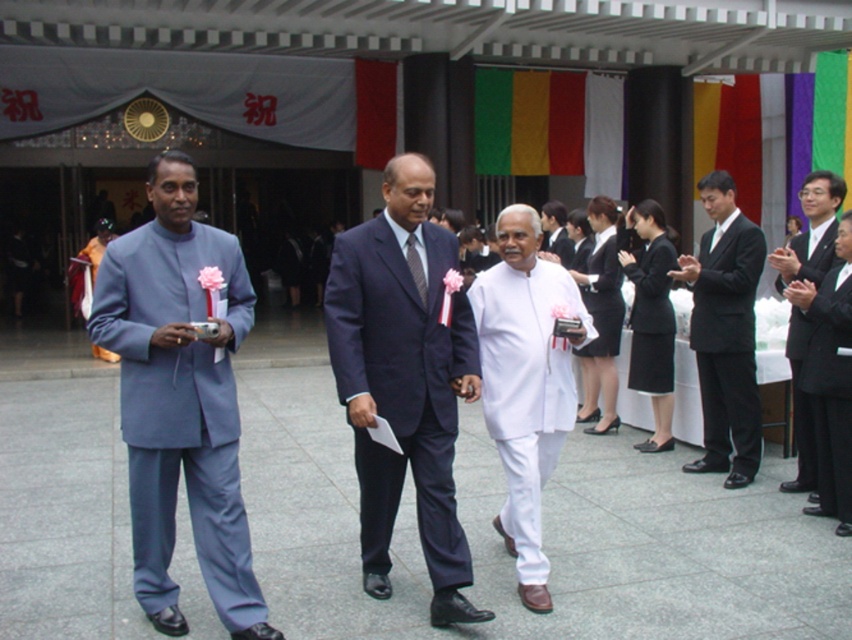
You are a photographer standing at the position of the man on the left. You need to take a photo of the dark blue suit at center and the black smooth suit at right. Can you capture both subjects in a single frame without moving your position? Explain your reasoning.

The distance between the dark blue suit at center and the black smooth suit at right is 7.28 feet. Depending on the camera lens used, a wide angle lens could potentially capture both subjects in a single frame without moving your position.

You are at the event and want to take a photo of both the dark blue suit at center and the black smooth suit at right. Since you can only focus on one person at a time, which one should you focus on first to ensure the other is still in the frame?

You should focus on the dark blue suit at center first because it is closer to the viewer than the black smooth suit at right, so keeping it in focus while the other remains in the background will still capture both in the frame.

You are attending the event and want to take a photo of the shiny black suit at right and the white cotton robe at center. Which one is closer to the camera?

The shiny black suit at right is positioned under the white cotton robe at center, so the white cotton robe at center is closer to the camera.